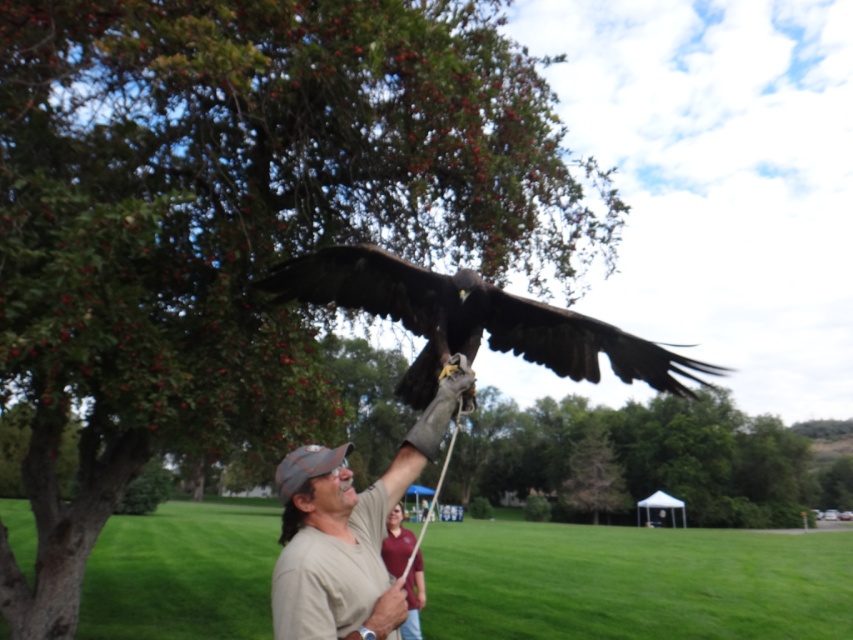
Looking at this image, is green leafy tree at upper left shorter than beige cotton shirt at center?

Incorrect, green leafy tree at upper left's height does not fall short of beige cotton shirt at center's.

In the scene shown: Can you confirm if green leafy tree at upper left is positioned above beige cotton shirt at center?

Indeed, green leafy tree at upper left is positioned over beige cotton shirt at center.

You are a GUI agent. You are given a task and a screenshot of the screen. Output one action in this format:
    pyautogui.click(x=<x>, y=<y>)
    Task: Click on the green leafy tree at upper left
    The width and height of the screenshot is (853, 640).
    Given the screenshot: What is the action you would take?
    pyautogui.click(x=236, y=220)

Find the location of a particular element. The image size is (853, 640). green leafy tree at upper left is located at coordinates (x=236, y=220).

Is point (450, 352) positioned after point (376, 600)?

Yes, it is.

The image size is (853, 640). What are the coordinates of `dark brown feathers at center` in the screenshot? It's located at (471, 321).

Is green leafy tree at upper left shorter than tan cotton shirt at center?

In fact, green leafy tree at upper left may be taller than tan cotton shirt at center.

Which is more to the right, green leafy tree at upper left or tan cotton shirt at center?

From the viewer's perspective, green leafy tree at upper left appears more on the right side.

Who is more distant from viewer, (134, 74) or (329, 480)?

The point (134, 74) is behind.

This screenshot has width=853, height=640. In order to click on green leafy tree at upper left in this screenshot , I will do `click(236, 220)`.